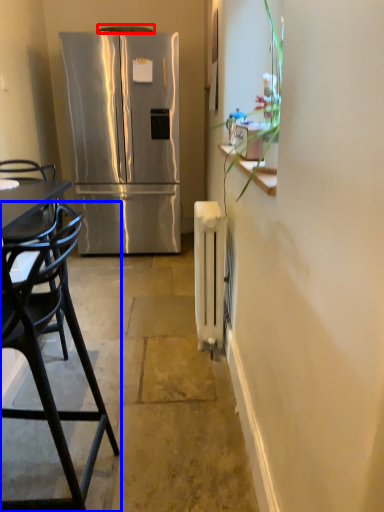
Question: Which object appears closest to the camera in this image, exhaust hood (highlighted by a red box) or chair (highlighted by a blue box)?

Choices:
 (A) exhaust hood
 (B) chair

Answer: (B)